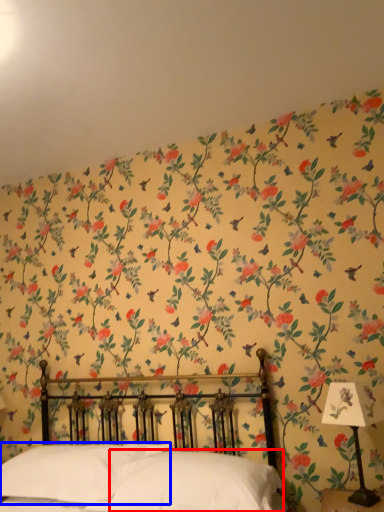
Question: Which object is further to the camera taking this photo, pillow (highlighted by a red box) or pillow (highlighted by a blue box)?

Choices:
 (A) pillow
 (B) pillow

Answer: (B)